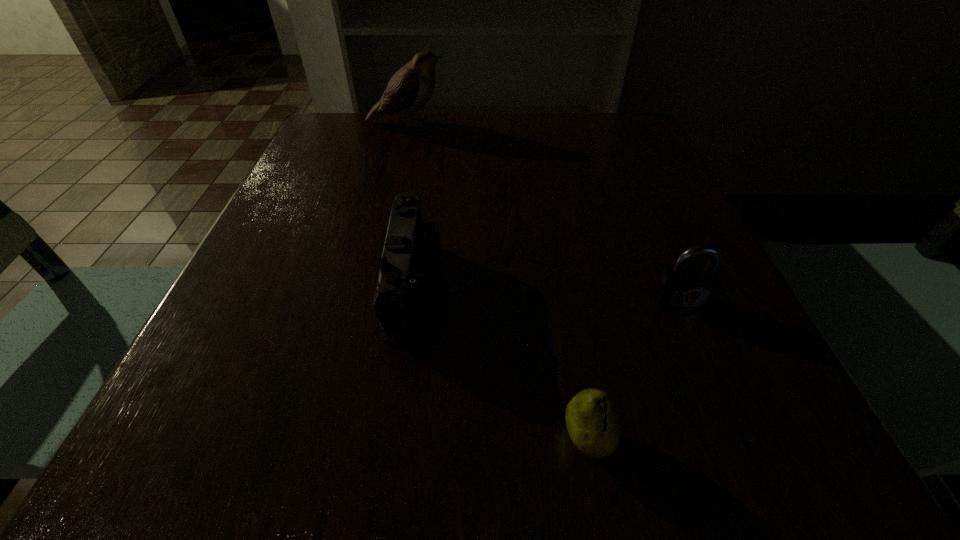
Locate which object is the second closest to the farthest object. Please provide its 2D coordinates. Your answer should be formatted as a tuple, i.e. [(x, y)], where the tuple contains the x and y coordinates of a point satisfying the conditions above.

[(681, 286)]

At what (x,y) coordinates should I click in order to perform the action: click on free space that satisfies the following two spatial constraints: 1. on the back side of the nearest object; 2. on the front-facing side of the camcorder. Please return your answer as a coordinate pair (x, y). The width and height of the screenshot is (960, 540). Looking at the image, I should click on (560, 284).

I want to click on vacant position in the image that satisfies the following two spatial constraints: 1. at the face of the farthest object; 2. on the left side of the nearest object, so click(324, 441).

This screenshot has width=960, height=540. Find the location of `free space that satisfies the following two spatial constraints: 1. on the front-facing side of the camcorder; 2. on the left side of the nearest object`. free space that satisfies the following two spatial constraints: 1. on the front-facing side of the camcorder; 2. on the left side of the nearest object is located at coordinates (390, 441).

This screenshot has height=540, width=960. I want to click on free space that satisfies the following two spatial constraints: 1. at the face of the tallest object; 2. on the right side of the pear, so click(324, 441).